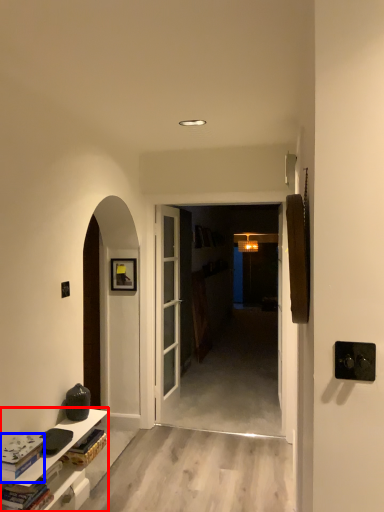
Question: Which object is further to the camera taking this photo, cabinetry (highlighted by a red box) or book (highlighted by a blue box)?

Choices:
 (A) cabinetry
 (B) book

Answer: (A)